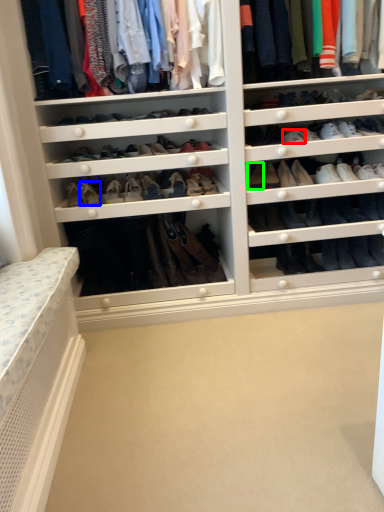
Question: Based on their relative distances, which object is nearer to shoe (highlighted by a red box)? Choose from shoe (highlighted by a blue box) and shoe (highlighted by a green box).

Choices:
 (A) shoe
 (B) shoe

Answer: (B)